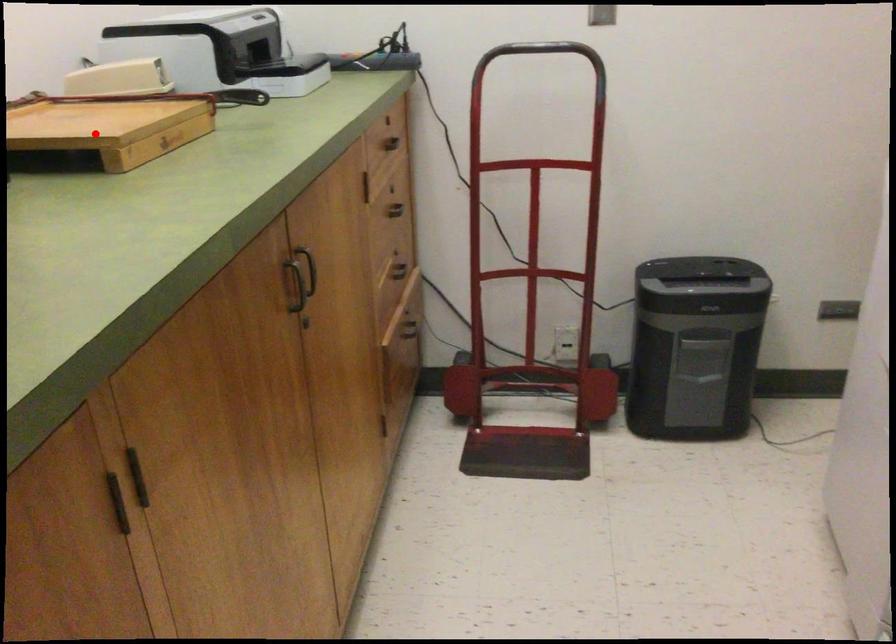
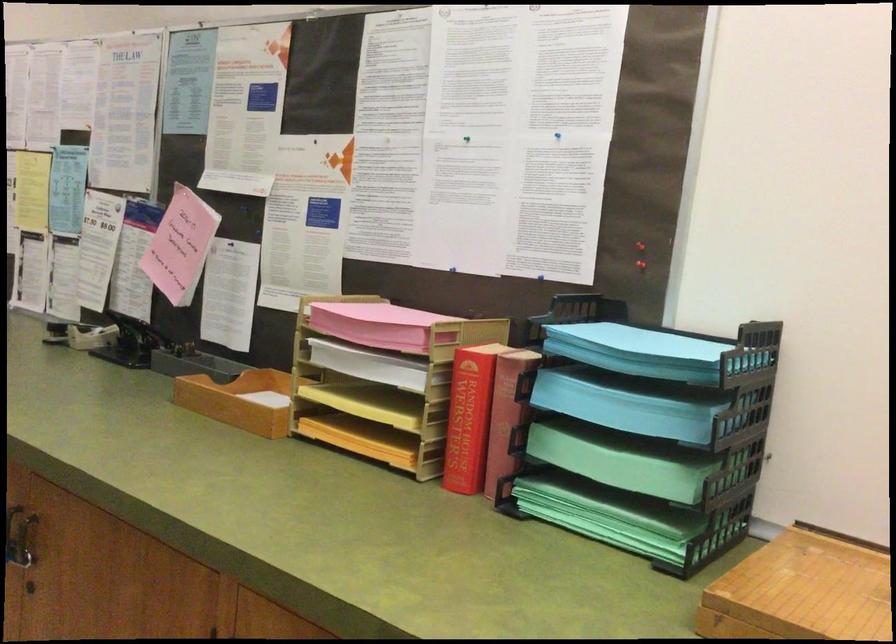
The point at the highlighted location is marked in the first image. Where is the corresponding point in the second image?

(800, 591)